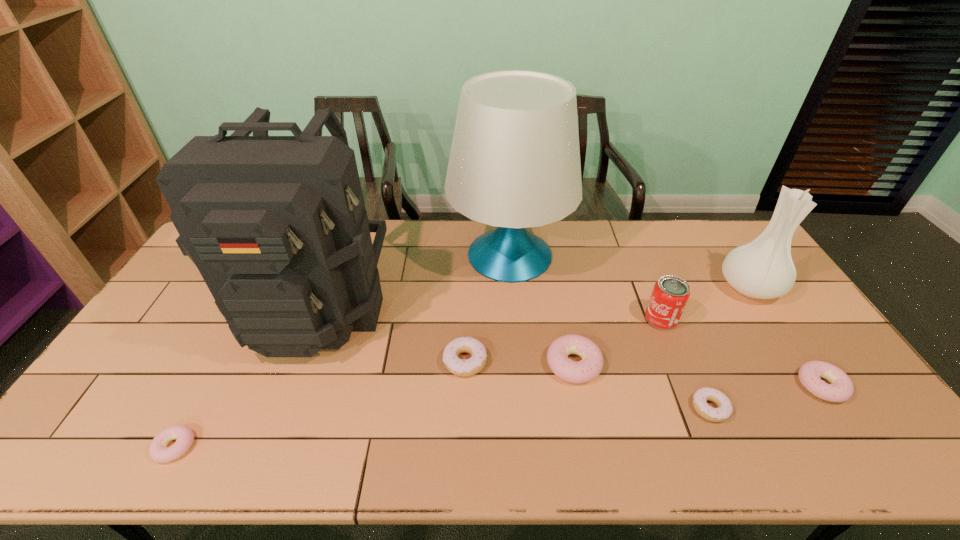
Find the location of a particular element. The width and height of the screenshot is (960, 540). vacant position located 0.360m on the front of the seventh shortest object is located at coordinates (834, 415).

Where is `vacant space located on the back of the red can`? vacant space located on the back of the red can is located at coordinates (650, 292).

Where is `vacant space located on the right of the second pink doughnut from left to right`? This screenshot has width=960, height=540. vacant space located on the right of the second pink doughnut from left to right is located at coordinates (736, 364).

At what (x,y) coordinates should I click in order to perform the action: click on free spot located on the left of the farther white doughnut. Please return your answer as a coordinate pair (x, y). The image size is (960, 540). Looking at the image, I should click on (327, 361).

Find the location of `vacant space situated 0.260m on the back of the rightmost doughnut`. vacant space situated 0.260m on the back of the rightmost doughnut is located at coordinates (763, 299).

The height and width of the screenshot is (540, 960). Identify the location of vacant space situated 0.240m on the left of the nearer white doughnut. (596, 408).

Where is `blank space located 0.390m on the right of the nearest pink doughnut`? The width and height of the screenshot is (960, 540). blank space located 0.390m on the right of the nearest pink doughnut is located at coordinates pos(361,447).

The image size is (960, 540). In order to click on table lamp located in the far edge section of the desktop in this screenshot , I will do `click(514, 163)`.

The width and height of the screenshot is (960, 540). Identify the location of backpack at the far edge. (276, 225).

Locate an element on the screen. This screenshot has width=960, height=540. object at the near edge is located at coordinates (158, 450).